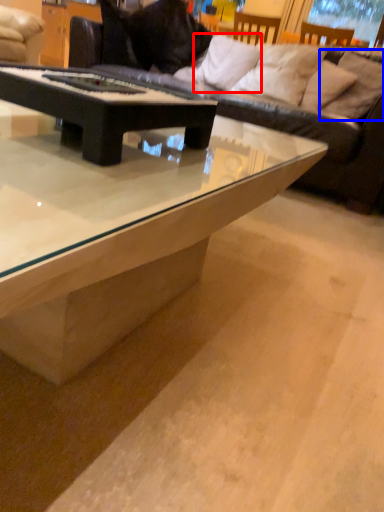
Question: Which object appears closest to the camera in this image, pillow (highlighted by a red box) or pillow (highlighted by a blue box)?

Choices:
 (A) pillow
 (B) pillow

Answer: (B)